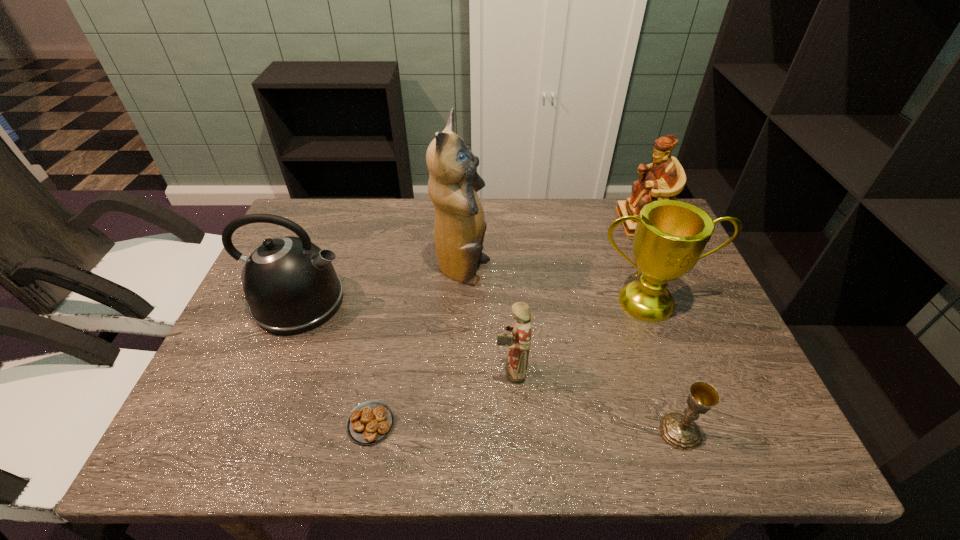
The image size is (960, 540). What are the coordinates of `object positioned at the near right corner` in the screenshot? It's located at (680, 431).

Find the location of `free space at the far edge of the desktop`. free space at the far edge of the desktop is located at coordinates (608, 234).

You are a GUI agent. You are given a task and a screenshot of the screen. Output one action in this format:
    pyautogui.click(x=<x>, y=<y>)
    Task: Click on the free location at the near edge
    The width and height of the screenshot is (960, 540).
    Given the screenshot: What is the action you would take?
    pyautogui.click(x=635, y=434)

Identify the location of free space at the left edge of the desktop. (233, 372).

Find the location of `blank space at the far left corner of the desktop`. blank space at the far left corner of the desktop is located at coordinates (314, 200).

Locate an element on the screen. Image resolution: width=960 pixels, height=540 pixels. free space at the near right corner is located at coordinates (740, 452).

Identify the location of empty space that is in between the farthest object and the cat. The height and width of the screenshot is (540, 960). (552, 247).

Image resolution: width=960 pixels, height=540 pixels. Find the location of `empty location between the chalice and the fourth object from right to left`. empty location between the chalice and the fourth object from right to left is located at coordinates (595, 401).

Identify the location of free point between the third shortest object and the tallest object. (487, 322).

Locate an element on the screen. The image size is (960, 540). vacant space in between the award and the kettle is located at coordinates (473, 302).